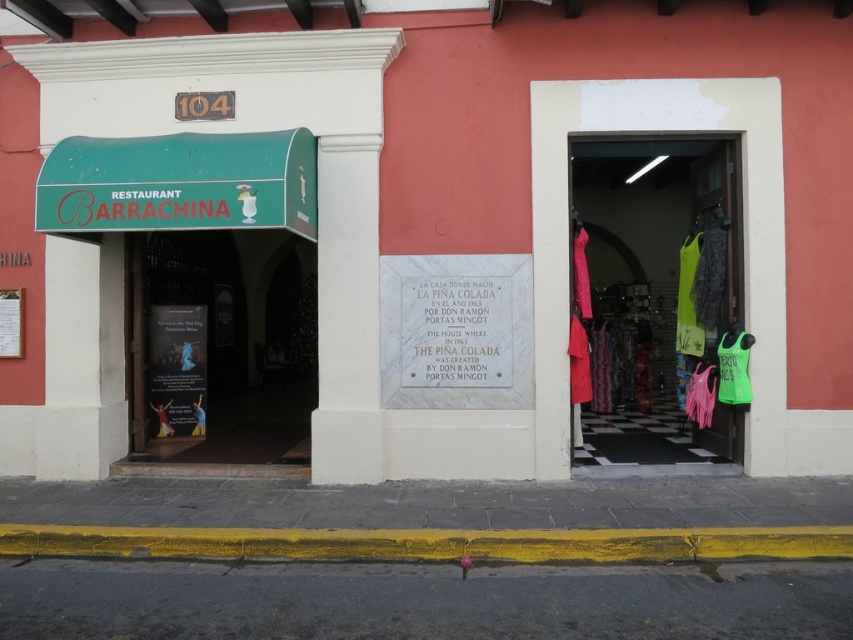
You are standing in front of the building and notice the neon green fabric at center and the matte paper poster at center. Which object is closer to you?

The neon green fabric at center is closer to you because it is positioned over the matte paper poster at center.